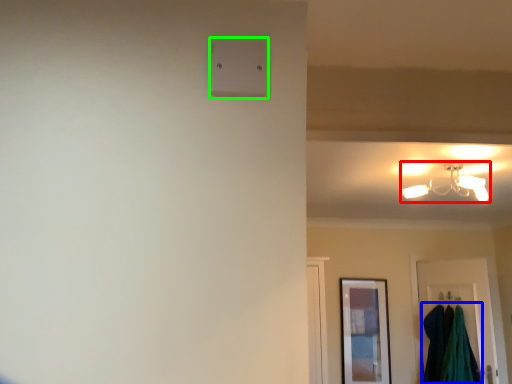
Question: Which object is positioned farthest from lamp (highlighted by a red box)? Select from laundry (highlighted by a blue box) and light switch (highlighted by a green box).

Choices:
 (A) laundry
 (B) light switch

Answer: (B)